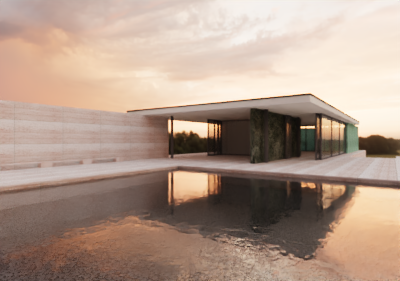
You are a GUI agent. You are given a task and a screenshot of the screen. Output one action in this format:
    pyautogui.click(x=<x>, y=<y>)
    Task: Click on the inner wall
    The image size is (400, 281).
    Given the screenshot: What is the action you would take?
    pyautogui.click(x=253, y=141), pyautogui.click(x=276, y=140), pyautogui.click(x=297, y=140), pyautogui.click(x=236, y=140)